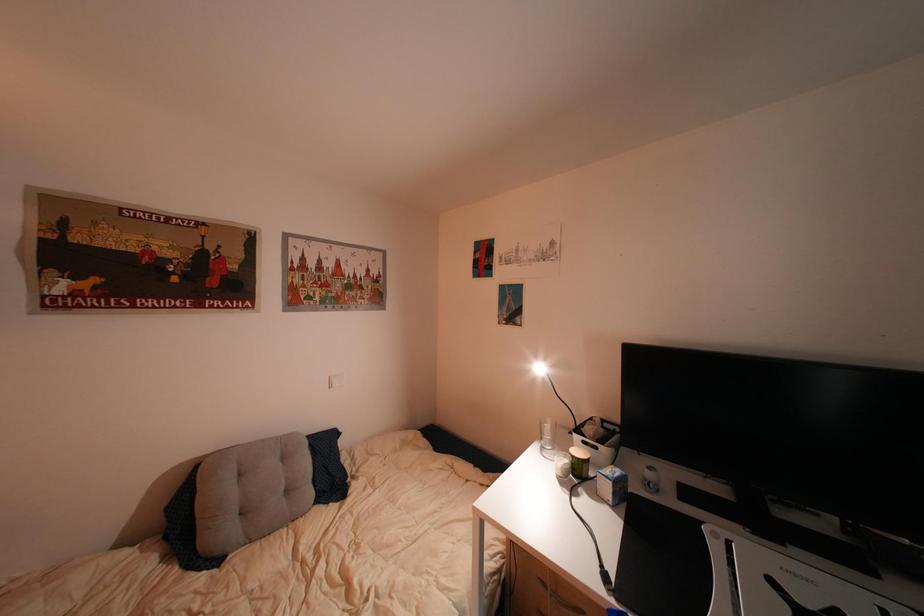
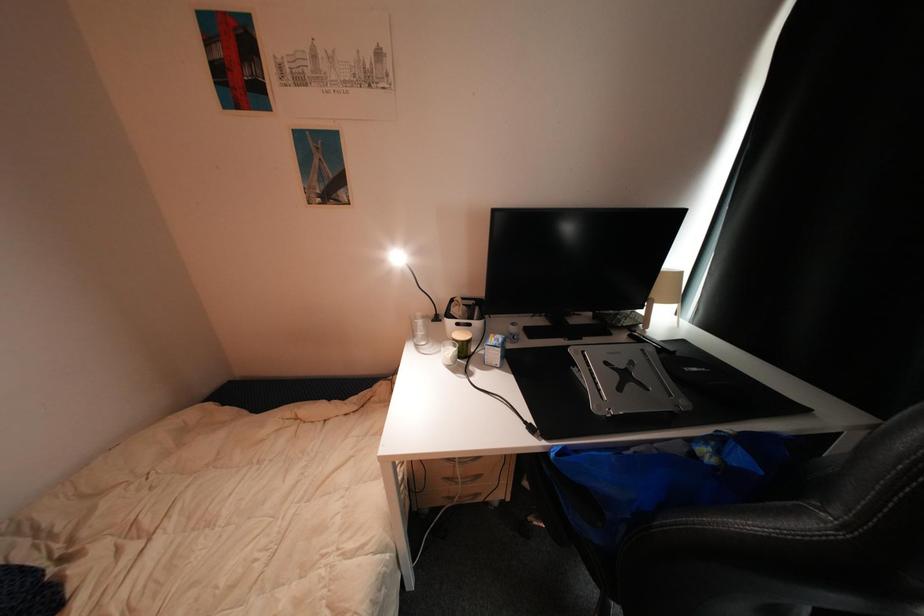
The images are taken continuously from a first-person perspective. In which direction is your viewpoint rotating?

The camera rotated toward right-down.